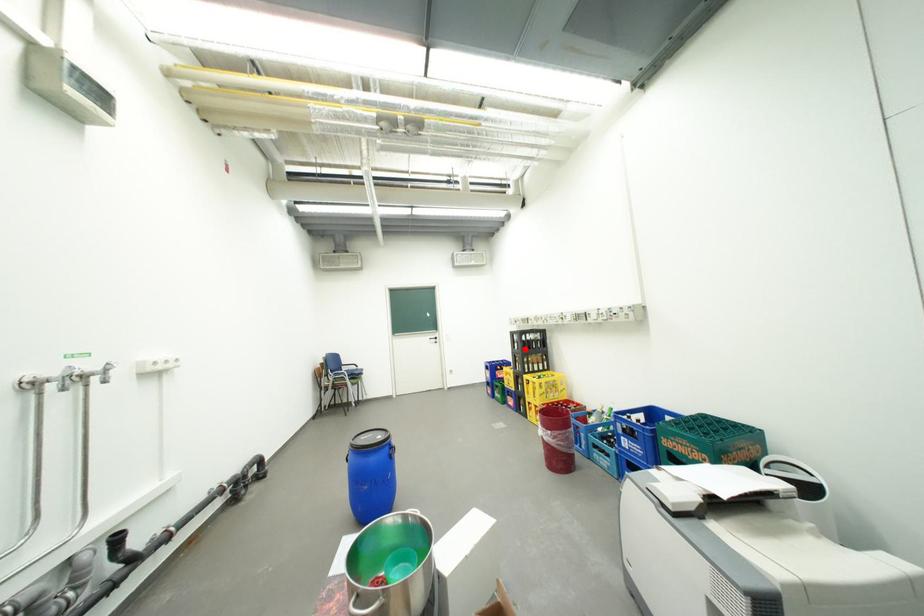
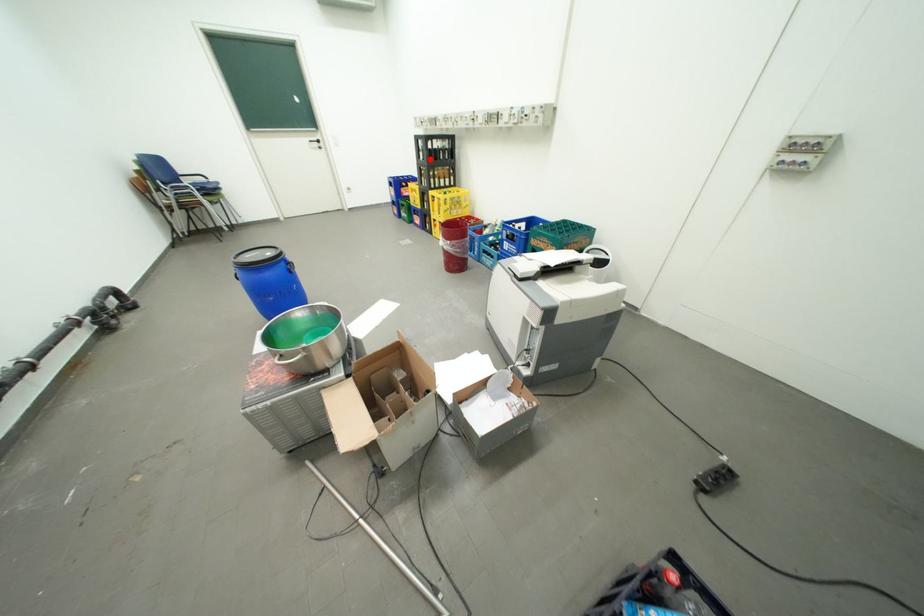
I am providing you with two images of the same scene from different viewpoints. A red point is marked on the first image and another point is marked on the second image. Does the point marked in image1 correspond to the same location as the one in image2?

Yes